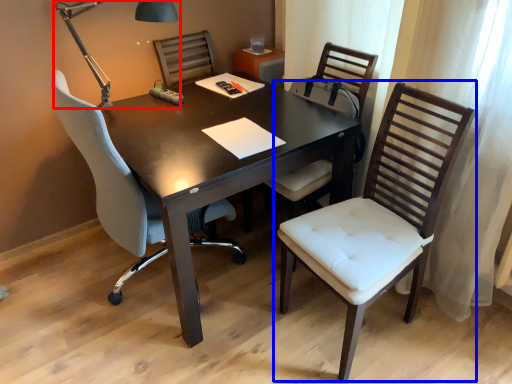
Question: Which point is closer to the camera, table lamp (highlighted by a red box) or chair (highlighted by a blue box)?

Choices:
 (A) table lamp
 (B) chair

Answer: (B)